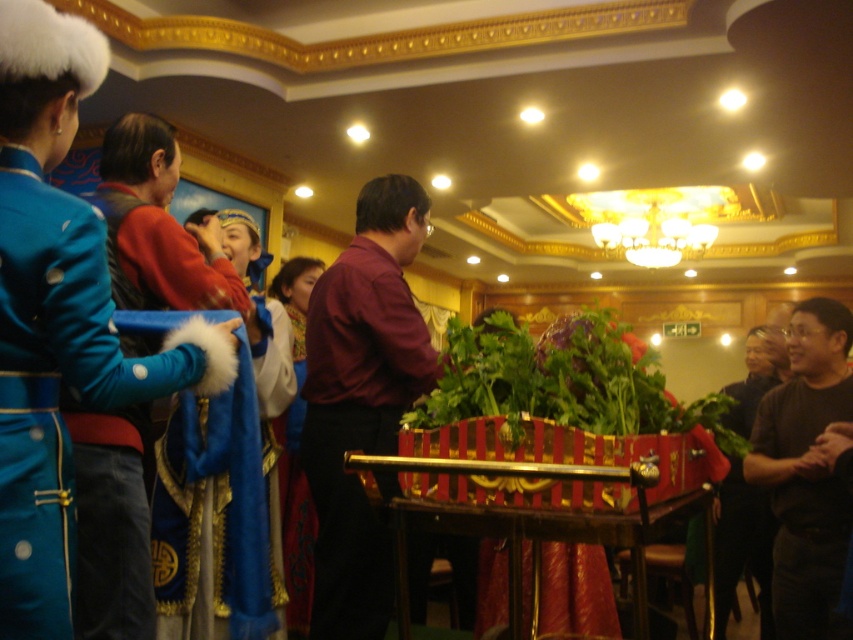
You are attending this event and need to locate the maroon shirt at center and the dark brown leather jacket at lower right. Based on their positions, which object is covering part of the other?

The maroon shirt at center is positioned over the dark brown leather jacket at lower right, so it is covering part of it.

You are a guest at this event and need to choose between the maroon shirt at center and the black matte shirt at right. Which shirt is taller?

The maroon shirt at center is taller than the black matte shirt at right.